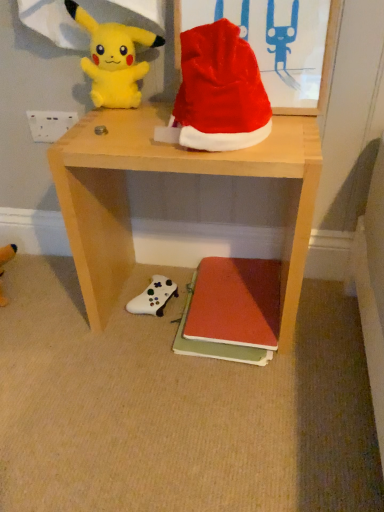
The width and height of the screenshot is (384, 512). Find the location of `free space above matte red book at lower center (from a real-world perspective)`. free space above matte red book at lower center (from a real-world perspective) is located at coordinates (239, 291).